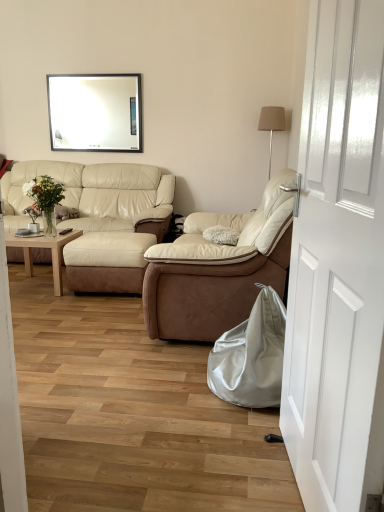
Identify the location of free space that is to the left of white glossy door at center. Image resolution: width=384 pixels, height=512 pixels. (190, 468).